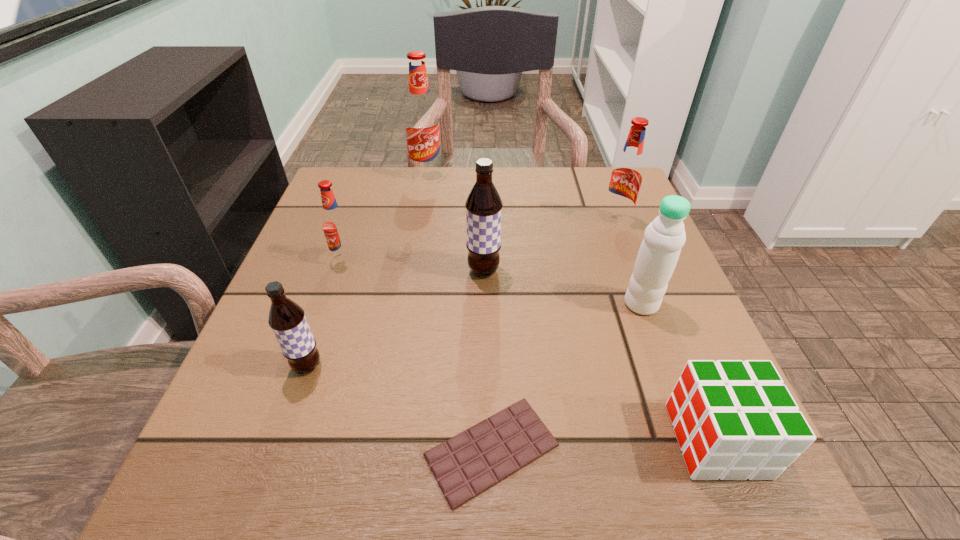
Where is `the sixth farthest object`? Image resolution: width=960 pixels, height=540 pixels. the sixth farthest object is located at coordinates pos(287,320).

You are a GUI agent. You are given a task and a screenshot of the screen. Output one action in this format:
    pyautogui.click(x=<x>, y=<y>)
    Task: Click on the left brown root beer
    
    Given the screenshot: What is the action you would take?
    click(287, 320)

You are a GUI agent. You are given a task and a screenshot of the screen. Output one action in this format:
    pyautogui.click(x=<x>, y=<y>)
    Task: Click on the red cube
    
    Given the screenshot: What is the action you would take?
    pyautogui.click(x=733, y=420)

The width and height of the screenshot is (960, 540). I want to click on the seventh tallest object, so click(733, 420).

You are a GUI agent. You are given a task and a screenshot of the screen. Output one action in this format:
    pyautogui.click(x=<x>, y=<y>)
    Task: Click on the chocolate bar
    
    Given the screenshot: What is the action you would take?
    pyautogui.click(x=469, y=463)

Locate an element on the screen. This screenshot has width=960, height=540. the shortest object is located at coordinates (469, 463).

At what (x,y) coordinates should I click in order to perform the action: click on vacant space located 0.210m on the right of the tallest root beer. Please return your answer as a coordinate pair (x, y). This screenshot has width=960, height=540. Looking at the image, I should click on (523, 175).

Find the location of a particular element. This screenshot has height=540, width=960. free space located 0.400m on the front of the rightmost red root beer is located at coordinates (678, 386).

This screenshot has height=540, width=960. I want to click on free region located 0.190m on the back of the right brown root beer, so click(x=483, y=207).

Where is `vacant space located on the front of the fourth nearest object`? vacant space located on the front of the fourth nearest object is located at coordinates (675, 395).